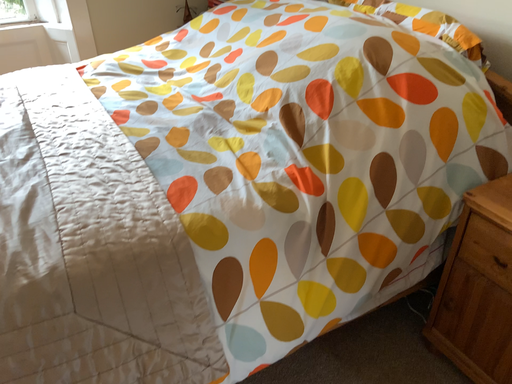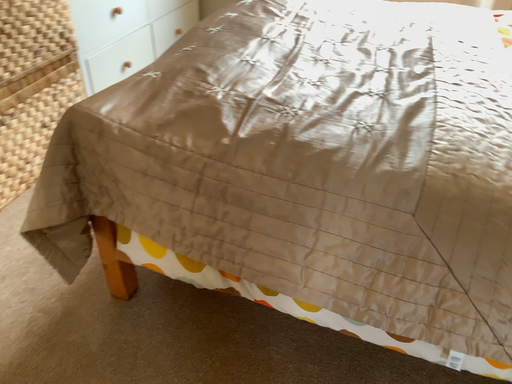
Question: Which way did the camera rotate in the video?

Choices:
 (A) rotated downward
 (B) rotated upward

Answer: (B)